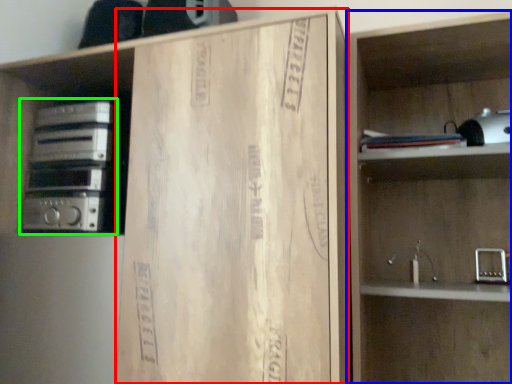
Question: Which object is positioned closest to cardboard (highlighted by a red box)? Select from shelf (highlighted by a blue box) and stereo (highlighted by a green box).

Choices:
 (A) shelf
 (B) stereo

Answer: (A)